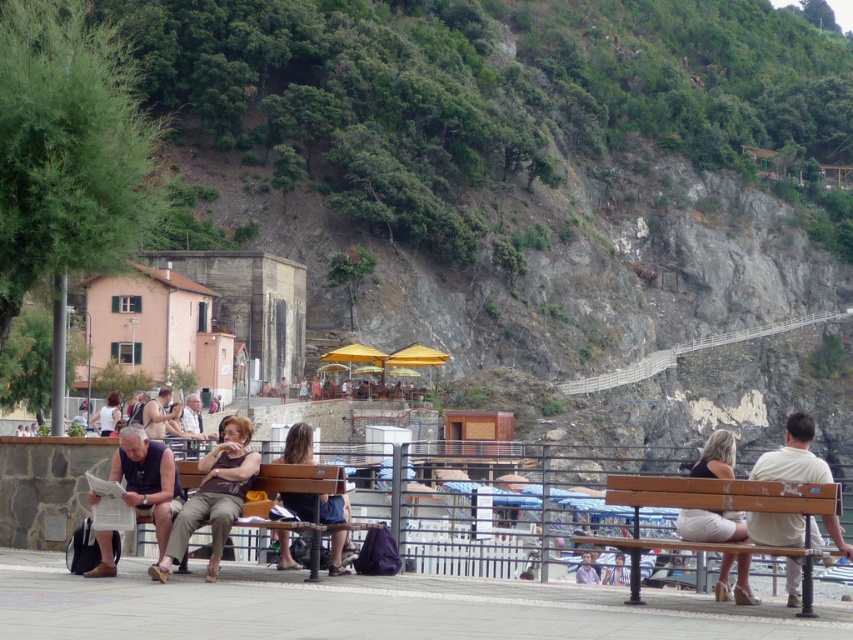
Which is more to the right, matte brown pants at center or light brown leather pants at left?

matte brown pants at center

Between matte brown pants at center and light brown leather pants at left, which one is positioned higher?

light brown leather pants at left is above.

Identify the location of matte brown pants at center. Image resolution: width=853 pixels, height=640 pixels. (213, 497).

Is matte brown pants at center above matte black tank top at center?

Indeed, matte brown pants at center is positioned over matte black tank top at center.

Consider the image. Does matte brown pants at center have a lesser width compared to matte black tank top at center?

Correct, matte brown pants at center's width is less than matte black tank top at center's.

Does point (207, 500) come in front of point (109, 400)?

Yes.

The image size is (853, 640). I want to click on matte brown pants at center, so click(x=213, y=497).

Is white cotton shirt at right above light beige fabric skirt at center?

Correct, white cotton shirt at right is located above light beige fabric skirt at center.

This screenshot has height=640, width=853. What do you see at coordinates (793, 456) in the screenshot?
I see `white cotton shirt at right` at bounding box center [793, 456].

Between point (788, 440) and point (728, 589), which one is positioned in front?

Point (728, 589) is more forward.

This screenshot has height=640, width=853. I want to click on white cotton shirt at right, so click(x=793, y=456).